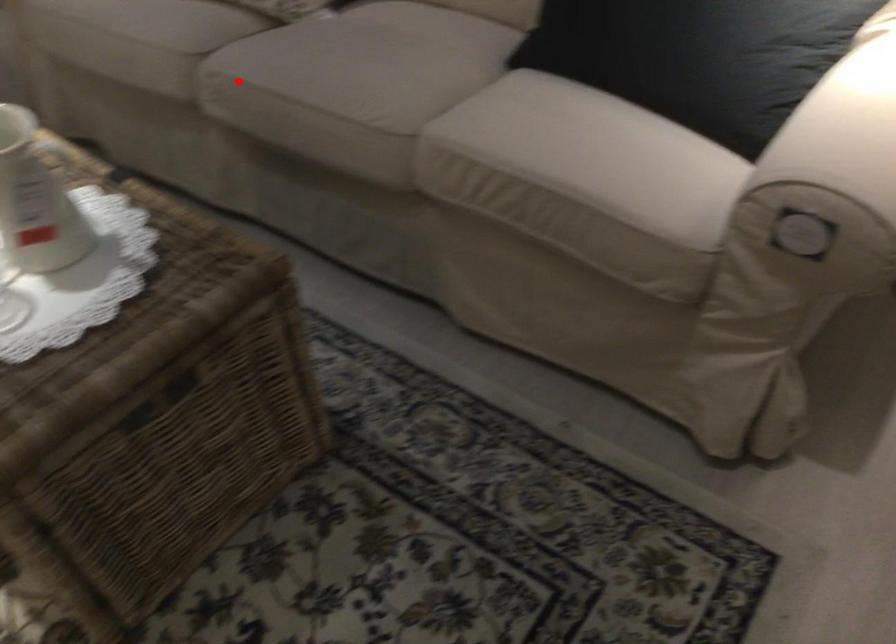
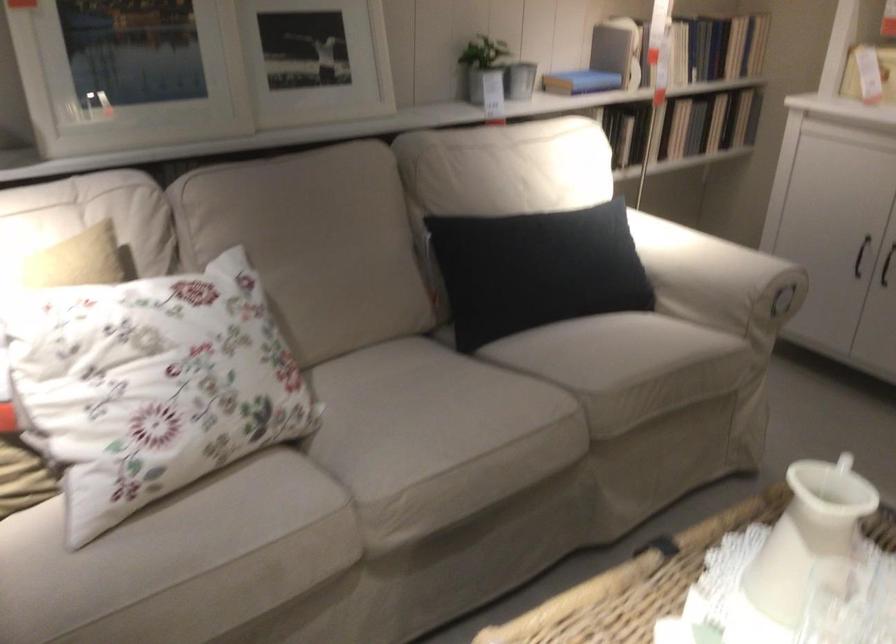
Find the pixel in the second image that matches the highlighted location in the first image.

(398, 494)